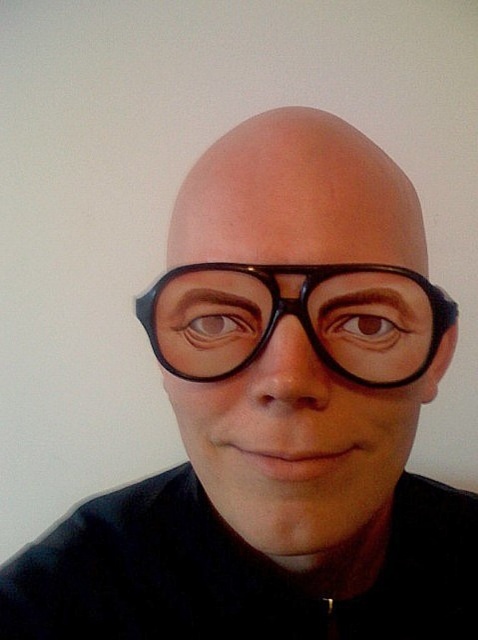
Question: Is black matte glasses at center smaller than black plastic glasses at center?

Choices:
 (A) no
 (B) yes

Answer: (A)

Question: Can you confirm if black matte glasses at center is positioned above black plastic glasses at center?

Choices:
 (A) yes
 (B) no

Answer: (A)

Question: Observing the image, what is the correct spatial positioning of black matte glasses at center in reference to black plastic glasses at center?

Choices:
 (A) above
 (B) below

Answer: (A)

Question: Which point appears farthest from the camera in this image?

Choices:
 (A) (236, 392)
 (B) (437, 339)

Answer: (B)

Question: Among these points, which one is farthest from the camera?

Choices:
 (A) (174, 324)
 (B) (240, 448)

Answer: (A)